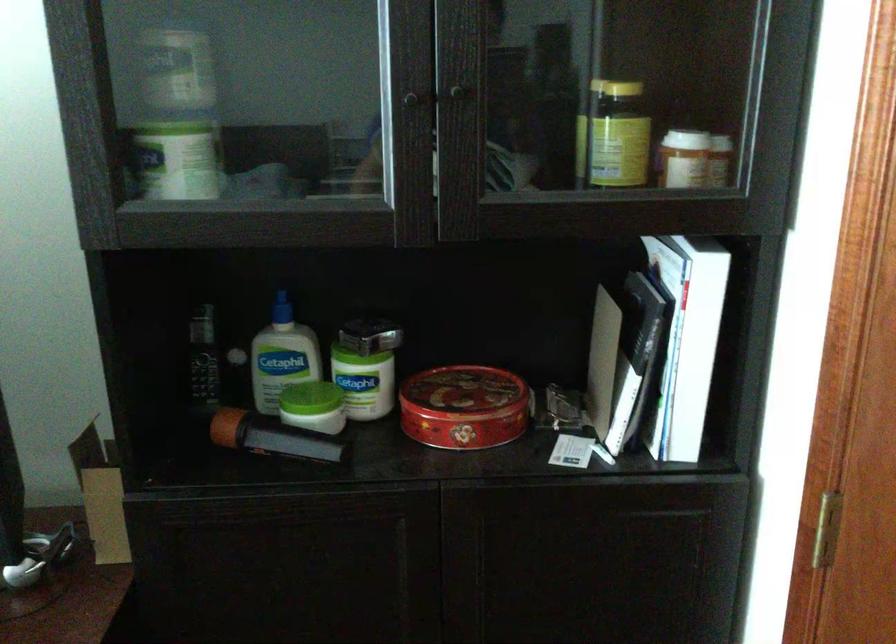
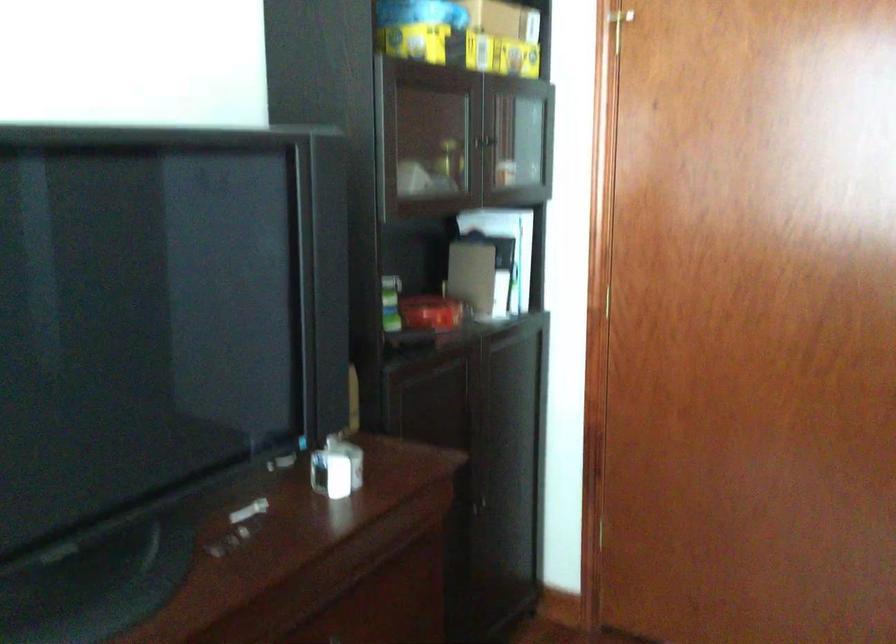
Question: I am providing you with two images of the same scene from different viewpoints. Please identify which objects are invisible in image2.

Choices:
 (A) decorative vase
 (B) cabinet handle
 (C) cordless phone handset
 (D) yellow cardboard box

Answer: (C)